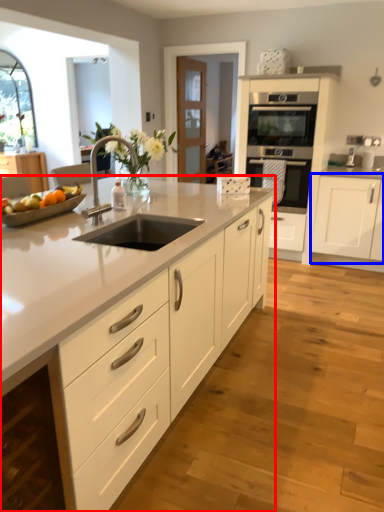
Question: Which object is further to the camera taking this photo, countertop (highlighted by a red box) or cabinetry (highlighted by a blue box)?

Choices:
 (A) countertop
 (B) cabinetry

Answer: (B)